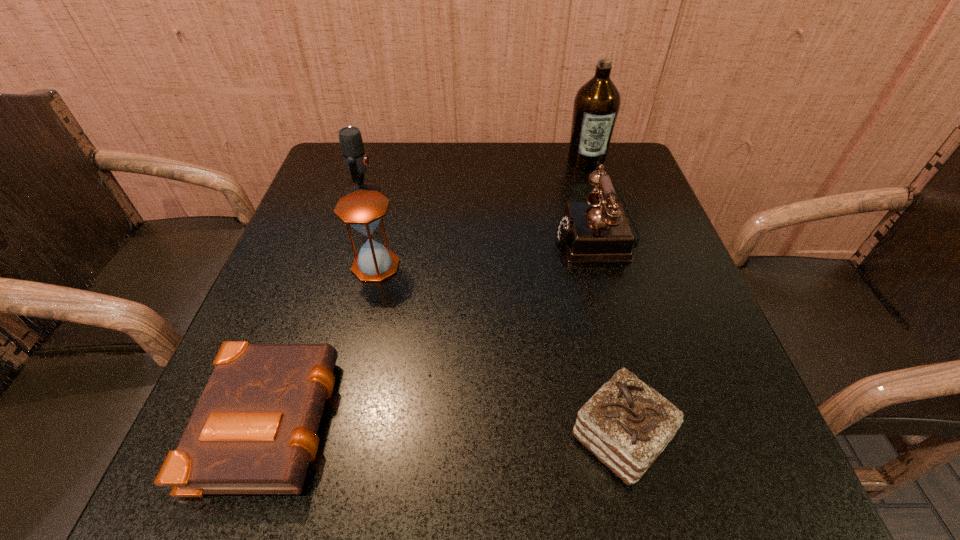
Locate an element on the screen. The image size is (960, 540). vacant region at the near edge of the desktop is located at coordinates (351, 459).

The height and width of the screenshot is (540, 960). I want to click on vacant space at the left edge of the desktop, so click(x=339, y=328).

Identify the location of free space at the right edge. This screenshot has width=960, height=540. (695, 421).

Locate an element on the screen. The width and height of the screenshot is (960, 540). free point at the far left corner is located at coordinates (374, 171).

At what (x,y) coordinates should I click in order to perform the action: click on free space between the farthest object and the microphone. Please return your answer as a coordinate pair (x, y). Looking at the image, I should click on (474, 177).

Where is `free spot between the chocolate cake and the telephone`? The image size is (960, 540). free spot between the chocolate cake and the telephone is located at coordinates (609, 338).

Locate an element on the screen. The width and height of the screenshot is (960, 540). free space between the telephone and the microphone is located at coordinates (480, 214).

Locate an element on the screen. This screenshot has height=540, width=960. free space between the hourglass and the telephone is located at coordinates (486, 251).

The image size is (960, 540). What are the coordinates of `vacant space in between the microphone and the telephone` in the screenshot? It's located at (480, 214).

You are a GUI agent. You are given a task and a screenshot of the screen. Output one action in this format:
    pyautogui.click(x=<x>, y=<y>)
    Task: Click on the free spot between the hourglass and the Bible
    The image size is (960, 540).
    Given the screenshot: What is the action you would take?
    pyautogui.click(x=324, y=341)